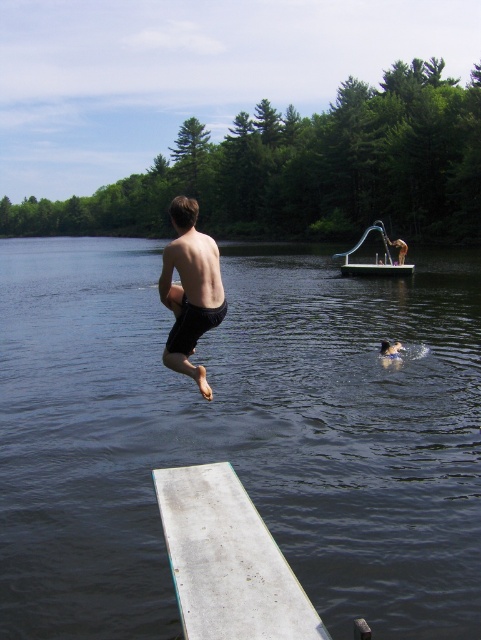
Between point (291, 593) and point (362, 241), which one is positioned in front?

Positioned in front is point (291, 593).

Does white matte dock at lower center come behind clear plastic boat at center?

No, white matte dock at lower center is in front of clear plastic boat at center.

Which is in front, point (205, 464) or point (356, 262)?

Point (205, 464)

Locate an element on the screen. This screenshot has width=481, height=640. white matte dock at lower center is located at coordinates (227, 561).

Does white matte dock at lower center have a greater height compared to matte black shorts at center?

Incorrect, white matte dock at lower center's height is not larger of matte black shorts at center's.

Is point (192, 474) positioned after point (168, 355)?

Yes.

Find the location of a particular element. Image resolution: width=481 pixels, height=640 pixels. white matte dock at lower center is located at coordinates (227, 561).

Which is behind, point (181, 314) or point (395, 262)?

The point (395, 262) is more distant.

Is matte black shorts at center shorter than clear plastic boat at center?

Indeed, matte black shorts at center has a lesser height compared to clear plastic boat at center.

Where is `matte black shorts at center`? The width and height of the screenshot is (481, 640). matte black shorts at center is located at coordinates (x=189, y=291).

Locate an element on the screen. matte black shorts at center is located at coordinates (189, 291).